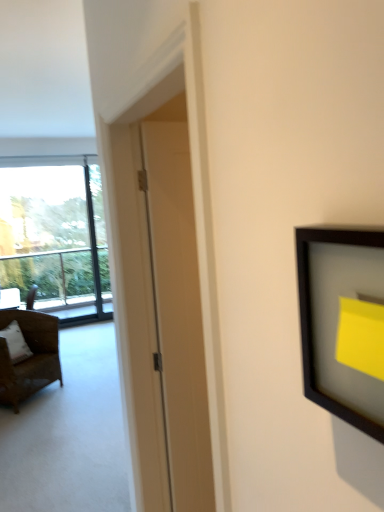
Question: Does white matte door at center lie in front of white fabric pillow at left?

Choices:
 (A) no
 (B) yes

Answer: (B)

Question: From a real-world perspective, is white matte door at center on white fabric pillow at left?

Choices:
 (A) no
 (B) yes

Answer: (B)

Question: Can you confirm if white matte door at center is thinner than white fabric pillow at left?

Choices:
 (A) no
 (B) yes

Answer: (B)

Question: Can we say white matte door at center lies outside white fabric pillow at left?

Choices:
 (A) no
 (B) yes

Answer: (B)

Question: Is white fabric pillow at left located within white matte door at center?

Choices:
 (A) no
 (B) yes

Answer: (A)

Question: Does point (21, 323) appear closer or farther from the camera than point (8, 338)?

Choices:
 (A) closer
 (B) farther

Answer: (B)

Question: Looking at their shapes, would you say brown wicker chair at left is wider or thinner than white fabric pillow at left?

Choices:
 (A) thin
 (B) wide

Answer: (B)

Question: Visually, is brown wicker chair at left positioned to the left or to the right of white fabric pillow at left?

Choices:
 (A) left
 (B) right

Answer: (B)

Question: In terms of size, does brown wicker chair at left appear bigger or smaller than white fabric pillow at left?

Choices:
 (A) big
 (B) small

Answer: (A)

Question: In the image, is transparent glass window at left positioned in front of or behind brown wicker chair at left?

Choices:
 (A) behind
 (B) front

Answer: (A)

Question: Looking at their shapes, would you say transparent glass window at left is wider or thinner than brown wicker chair at left?

Choices:
 (A) wide
 (B) thin

Answer: (B)

Question: From a real-world perspective, is transparent glass window at left above or below brown wicker chair at left?

Choices:
 (A) above
 (B) below

Answer: (A)

Question: Visually, is transparent glass window at left positioned to the left or to the right of brown wicker chair at left?

Choices:
 (A) right
 (B) left

Answer: (B)

Question: Looking at their shapes, would you say white matte door at center is wider or thinner than transparent glass window at left?

Choices:
 (A) wide
 (B) thin

Answer: (B)

Question: Based on their positions, is white matte door at center located to the left or right of transparent glass window at left?

Choices:
 (A) left
 (B) right

Answer: (B)